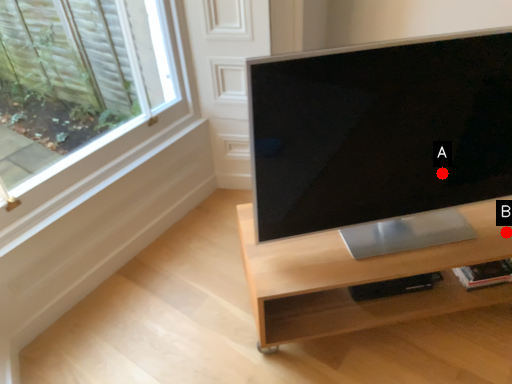
Question: Two points are circled on the image, labeled by A and B beside each circle. Which point is further to the camera?

Choices:
 (A) A is further
 (B) B is further

Answer: (B)